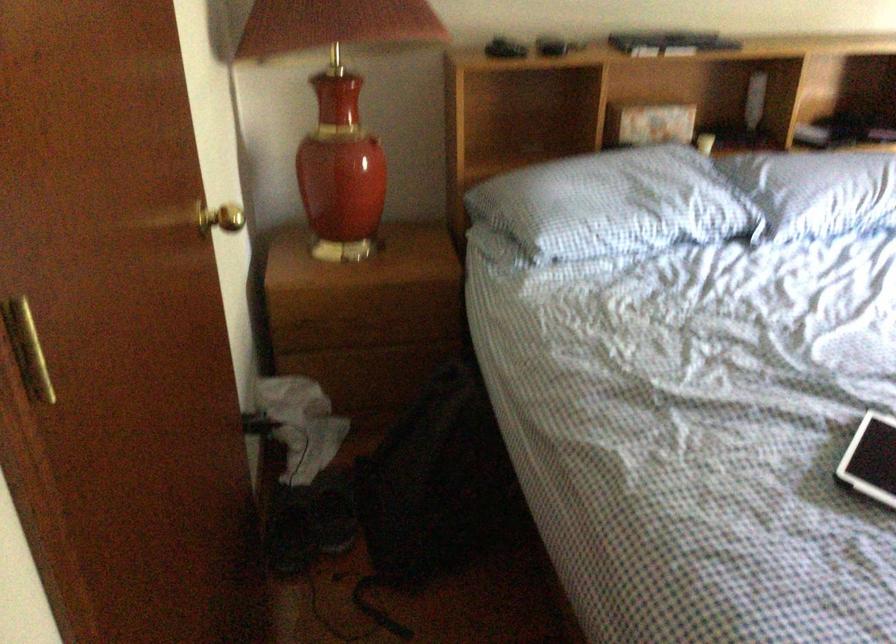
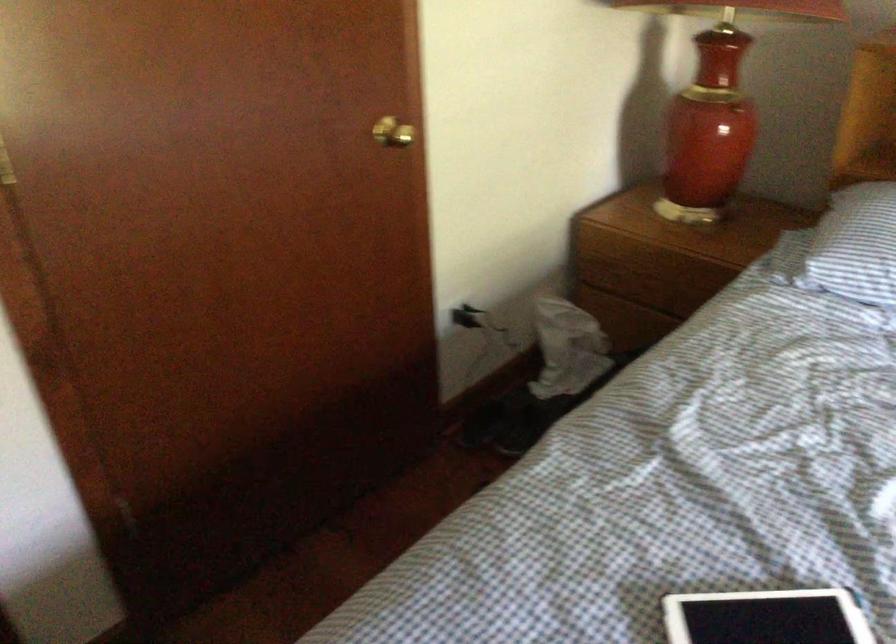
Question: I am providing you with two images of the same scene from different viewpoints. Please identify which objects are invisible in image2.

Choices:
 (A) nightstand drawer pull
 (B) white tablet
 (C) gold doorknob
 (D) none of these

Answer: (D)